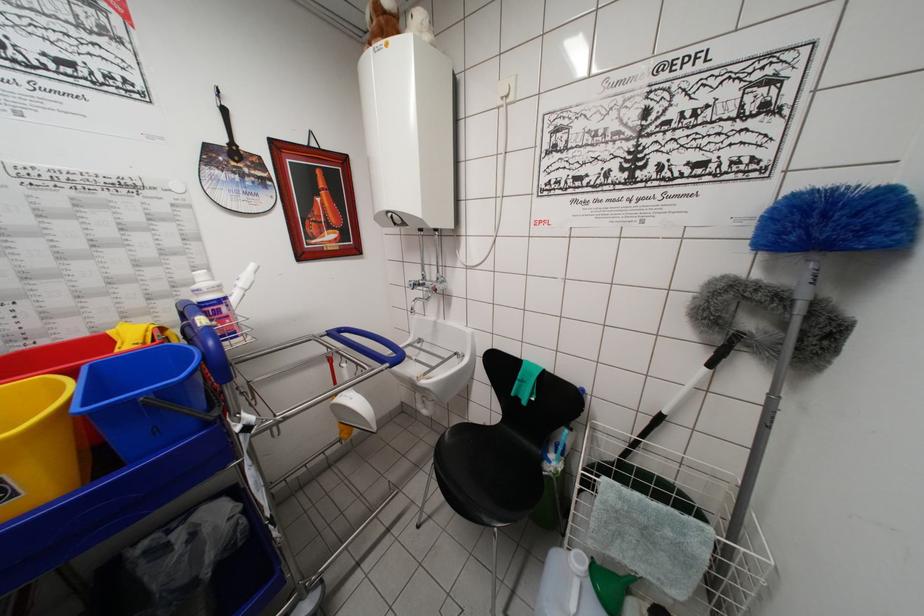
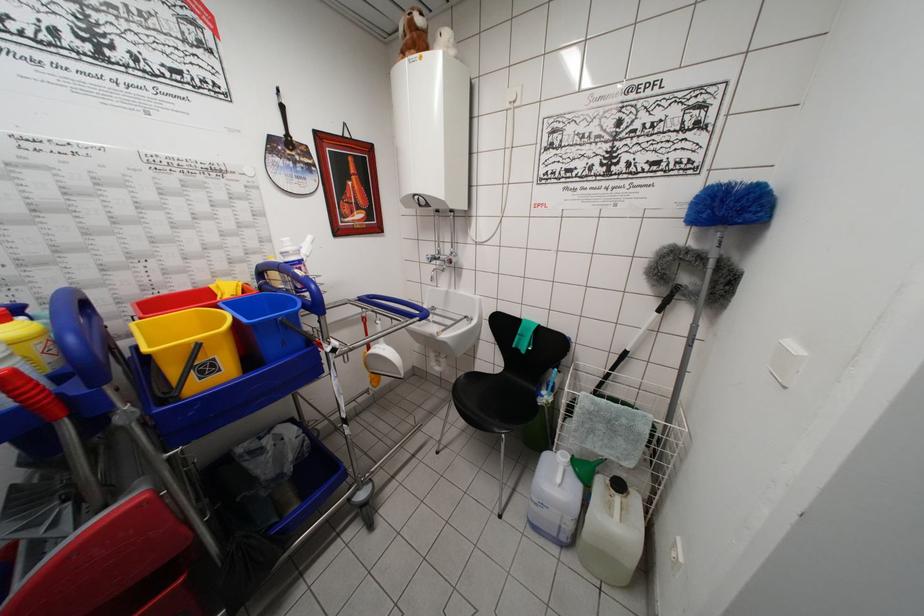
The point at (658, 419) is marked in the first image. Where is the corresponding point in the second image?

(624, 358)